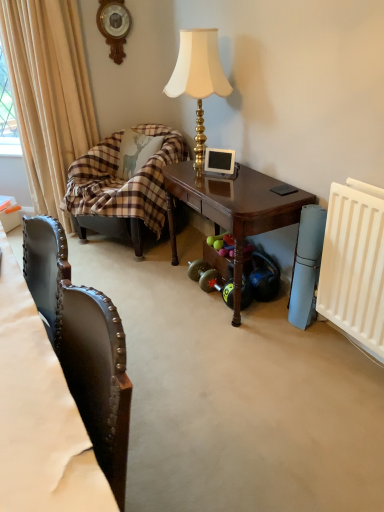
Question: Considering the positions of point (271, 269) and point (160, 134), is point (271, 269) closer or farther from the camera than point (160, 134)?

Choices:
 (A) closer
 (B) farther

Answer: (A)

Question: From the image's perspective, relative to plaid fabric couch at left, is rubberized black dumbbell at lower right above or below?

Choices:
 (A) below
 (B) above

Answer: (A)

Question: Estimate the real-world distances between objects in this image. Which object is farther from the leather at left?

Choices:
 (A) gold textured lamp at upper center
 (B) plaid fabric couch at left
 (C) beige fabric curtain at left
 (D) white plastic radiator at right
 (E) rubberized black dumbbell at lower right

Answer: (C)

Question: Which of these objects is positioned farthest from the plaid fabric couch at left?

Choices:
 (A) leather at left
 (B) beige fabric curtain at left
 (C) dark wood table at center
 (D) rubberized black dumbbell at lower right
 (E) white plastic radiator at right

Answer: (A)